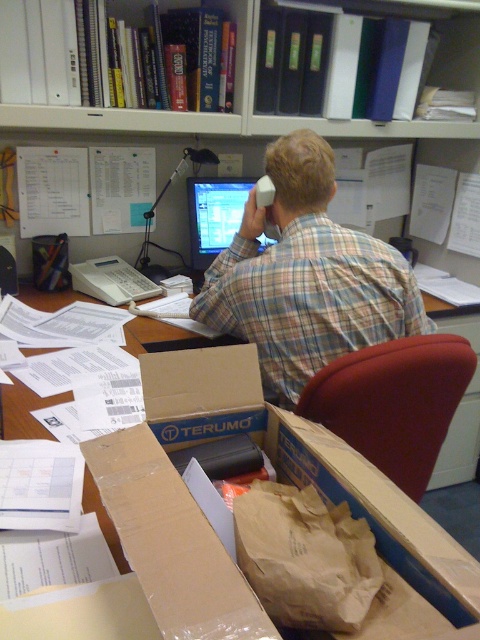
Between point (385, 556) and point (137, 128), which one is positioned behind?

The point (137, 128) is behind.

Consider the image. Is brown cardboard box at center bigger than black plastic bookshelf at upper center?

No.

This screenshot has height=640, width=480. Describe the element at coordinates (277, 477) in the screenshot. I see `brown cardboard box at center` at that location.

You are a GUI agent. You are given a task and a screenshot of the screen. Output one action in this format:
    pyautogui.click(x=<x>, y=<y>)
    Task: Click on the brown cardboard box at center
    The image size is (480, 640).
    Given the screenshot: What is the action you would take?
    pyautogui.click(x=277, y=477)

Can you confirm if black plastic bookshelf at upper center is positioned below matte plastic monitor at center?

Incorrect, black plastic bookshelf at upper center is not positioned below matte plastic monitor at center.

From the picture: Who is higher up, black plastic bookshelf at upper center or matte plastic monitor at center?

black plastic bookshelf at upper center

Where is `black plastic bookshelf at upper center`? The width and height of the screenshot is (480, 640). black plastic bookshelf at upper center is located at coordinates (218, 115).

Does point (204, 349) come behind point (201, 307)?

No.

Does brown cardboard box at center have a larger size compared to plaid shirt at center?

Actually, brown cardboard box at center might be smaller than plaid shirt at center.

Which is in front, point (160, 611) or point (383, 262)?

Point (160, 611) is in front.

Locate an element on the screen. brown cardboard box at center is located at coordinates (277, 477).